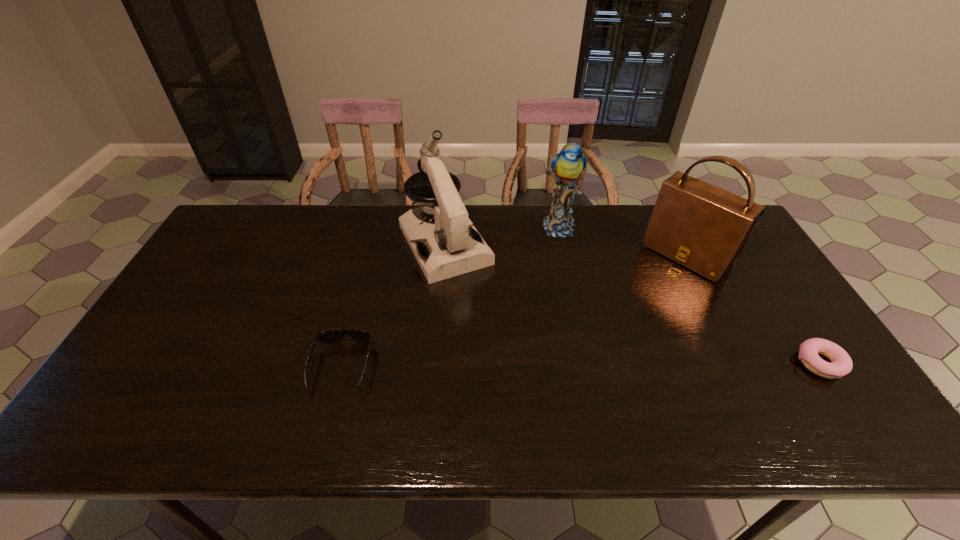
Identify the location of doughnut present at the near edge. The image size is (960, 540). (841, 364).

This screenshot has height=540, width=960. In order to click on doughnut at the right edge in this screenshot , I will do `click(841, 364)`.

The width and height of the screenshot is (960, 540). I want to click on shoulder bag that is at the right edge, so click(703, 227).

The width and height of the screenshot is (960, 540). In order to click on object that is at the far right corner in this screenshot , I will do `click(703, 227)`.

Locate an element on the screen. The height and width of the screenshot is (540, 960). object present at the near right corner is located at coordinates (841, 364).

Locate an element on the screen. free space at the far edge of the desktop is located at coordinates pyautogui.click(x=581, y=227).

You are a GUI agent. You are given a task and a screenshot of the screen. Output one action in this format:
    pyautogui.click(x=<x>, y=<y>)
    Task: Click on the blank space at the near edge of the desktop
    Image resolution: width=960 pixels, height=540 pixels.
    Given the screenshot: What is the action you would take?
    pyautogui.click(x=433, y=373)

Find the location of a particular element. vacant space at the left edge is located at coordinates (153, 336).

You are a GUI agent. You are given a task and a screenshot of the screen. Output one action in this format:
    pyautogui.click(x=<x>, y=<y>)
    Task: Click on the free space at the right edge of the desktop
    This screenshot has width=960, height=540.
    Given the screenshot: What is the action you would take?
    pyautogui.click(x=767, y=326)

You are a GUI agent. You are given a task and a screenshot of the screen. Output one action in this format:
    pyautogui.click(x=<x>, y=<y>)
    Task: Click on the vacant space at the far left corner of the desktop
    This screenshot has height=540, width=960.
    Given the screenshot: What is the action you would take?
    pyautogui.click(x=267, y=212)